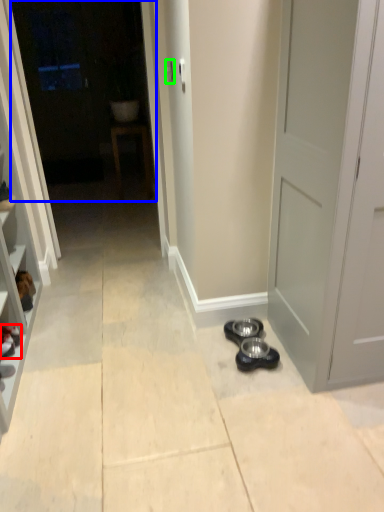
Question: Based on their relative distances, which object is nearer to footwear (highlighted by a red box)? Choose from glass door (highlighted by a blue box) and door handle (highlighted by a green box).

Choices:
 (A) glass door
 (B) door handle

Answer: (B)